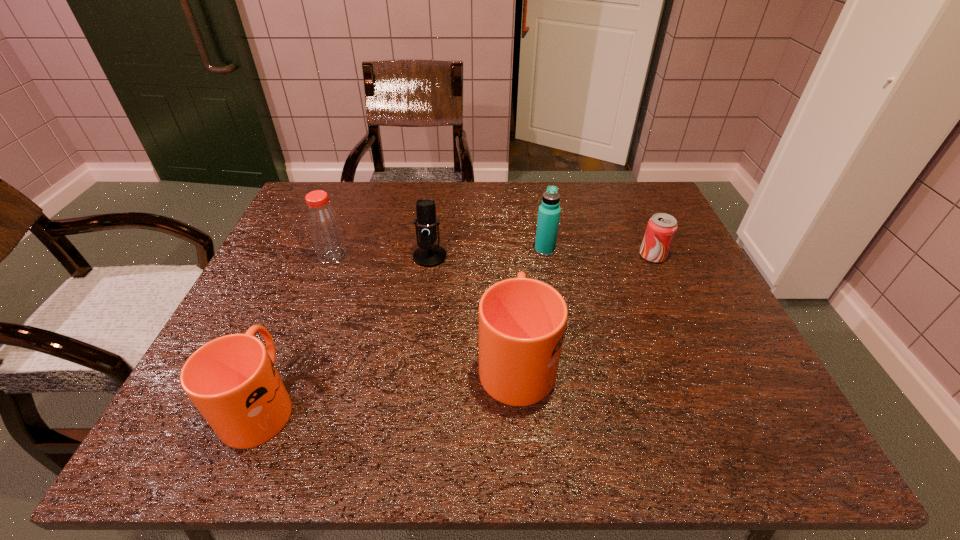
The mugs are evenly distributed in the image. To maintain this, where would you place another mug on the right? Please point to a free space. Please provide its 2D coordinates. Your answer should be formatted as a tuple, i.e. [(x, y)], where the tuple contains the x and y coordinates of a point satisfying the conditions above.

[(732, 322)]